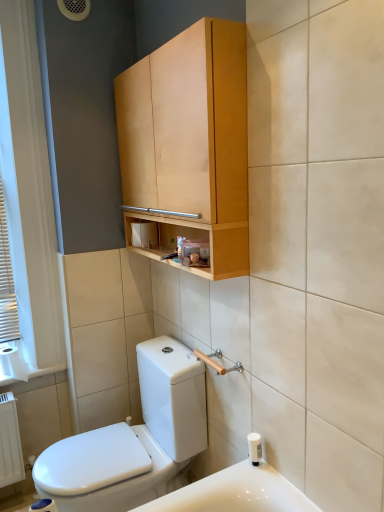
Where is `white glossy toilet at lower left`? white glossy toilet at lower left is located at coordinates (133, 439).

The height and width of the screenshot is (512, 384). In order to click on white matte toilet paper at center in this screenshot , I will do `click(144, 234)`.

Where is `white paper at left`? white paper at left is located at coordinates pos(12,362).

What do you see at coordinates (12, 362) in the screenshot? Image resolution: width=384 pixels, height=512 pixels. I see `white paper at left` at bounding box center [12, 362].

This screenshot has height=512, width=384. In order to click on light wood cabinet at upper center in this screenshot , I will do `click(189, 143)`.

Where is `white wooden blinds at left`? The height and width of the screenshot is (512, 384). white wooden blinds at left is located at coordinates (6, 282).

From a real-world perspective, does white plastic soap dispenser at lower right sit lower than white glossy toilet at lower left?

No, from a real-world perspective, white plastic soap dispenser at lower right is not beneath white glossy toilet at lower left.

Where is `toiletry above the white glossy toilet at lower left (from the image's perspective)`? toiletry above the white glossy toilet at lower left (from the image's perspective) is located at coordinates (254, 448).

Is white plastic soap dispenser at lower right positioned before white glossy toilet at lower left?

No, white plastic soap dispenser at lower right is further to the viewer.

This screenshot has width=384, height=512. I want to click on toiletry on the right of white paper at left, so click(x=254, y=448).

In the scene shown: Considering the sizes of white plastic soap dispenser at lower right and white paper at left in the image, is white plastic soap dispenser at lower right bigger or smaller than white paper at left?

Clearly, white plastic soap dispenser at lower right is smaller in size than white paper at left.

Is point (256, 441) closer or farther from the camera than point (13, 356)?

Point (256, 441) is closer to the camera than point (13, 356).

From the image's perspective, which is below, white wooden blinds at left or white glossy toilet at lower left?

From the image's view, white glossy toilet at lower left is below.

In terms of width, does white wooden blinds at left look wider or thinner when compared to white glossy toilet at lower left?

Clearly, white wooden blinds at left has less width compared to white glossy toilet at lower left.

Considering the positions of objects white wooden blinds at left and white glossy toilet at lower left in the image provided, who is more to the left, white wooden blinds at left or white glossy toilet at lower left?

Positioned to the left is white wooden blinds at left.

Which of these two, white wooden blinds at left or white glossy toilet at lower left, is smaller?

With smaller size is white wooden blinds at left.

Does point (132, 168) come behind point (17, 374)?

No.

From a real-world perspective, is light wood cabinet at upper center over white paper at left?

Yes, from a real-world perspective, light wood cabinet at upper center is on top of white paper at left.

Is light wood cabinet at upper center taller than white paper at left?

Correct, light wood cabinet at upper center is much taller as white paper at left.

Could you tell me if light wood cabinet at upper center is facing white paper at left?

No.

Looking at this image, could you tell me if white matte toilet paper at center is facing white paper at left?

No, white matte toilet paper at center is not oriented towards white paper at left.

Considering the sizes of objects white matte toilet paper at center and white paper at left in the image provided, who is bigger, white matte toilet paper at center or white paper at left?

white paper at left.

Would you say white matte toilet paper at center is outside white paper at left?

Yes, white matte toilet paper at center is outside of white paper at left.

From a real-world perspective, relative to white paper at left, is white matte toilet paper at center vertically above or below?

In terms of real-world spatial position, white matte toilet paper at center is above white paper at left.

Does point (172, 179) lie in front of point (145, 243)?

Yes, it is.

The height and width of the screenshot is (512, 384). In order to click on toilet paper behind the light wood cabinet at upper center in this screenshot , I will do `click(144, 234)`.

Consider the image. Is light wood cabinet at upper center looking in the opposite direction of white matte toilet paper at center?

Yes, light wood cabinet at upper center's orientation is away from white matte toilet paper at center.

In terms of width, does white matte toilet paper at center look wider or thinner when compared to light wood cabinet at upper center?

In the image, white matte toilet paper at center appears to be more narrow than light wood cabinet at upper center.

Is white matte toilet paper at center placed right next to light wood cabinet at upper center?

No, white matte toilet paper at center is not making contact with light wood cabinet at upper center.

Considering the positions of objects white matte toilet paper at center and light wood cabinet at upper center in the image provided, who is more to the left, white matte toilet paper at center or light wood cabinet at upper center?

white matte toilet paper at center.

Between white matte toilet paper at center and light wood cabinet at upper center, which one has larger size?

With larger size is light wood cabinet at upper center.

This screenshot has width=384, height=512. Identify the location of toilet in front of the white plastic soap dispenser at lower right. (133, 439).

Locate an element on the screen. toiletry located underneath the white paper at left (from a real-world perspective) is located at coordinates (254, 448).

Estimate the real-world distances between objects in this image. Which object is closer to white wooden blinds at left, white plastic soap dispenser at lower right or light wood cabinet at upper center?

Based on the image, light wood cabinet at upper center appears to be nearer to white wooden blinds at left.

Based on their spatial positions, is white wooden blinds at left or white glossy toilet at lower left closer to light wood cabinet at upper center?

The object closer to light wood cabinet at upper center is white glossy toilet at lower left.

From the image, which object appears to be nearer to light wood cabinet at upper center, white wooden blinds at left or white matte toilet paper at center?

Based on the image, white matte toilet paper at center appears to be nearer to light wood cabinet at upper center.

Looking at the image, which one is located further to white paper at left, white glossy toilet at lower left or white matte toilet paper at center?

The object further to white paper at left is white matte toilet paper at center.

Estimate the real-world distances between objects in this image. Which object is closer to white matte toilet paper at center, white paper at left or white wooden blinds at left?

white wooden blinds at left is closer to white matte toilet paper at center.

From the image, which object appears to be nearer to white wooden blinds at left, light wood cabinet at upper center or white plastic soap dispenser at lower right?

The object closer to white wooden blinds at left is light wood cabinet at upper center.

Based on their spatial positions, is white glossy toilet at lower left or light wood cabinet at upper center further from white wooden blinds at left?

light wood cabinet at upper center.

Considering their positions, is white paper at left positioned further to white wooden blinds at left than white glossy toilet at lower left?

Based on the image, white glossy toilet at lower left appears to be further to white wooden blinds at left.

This screenshot has width=384, height=512. Find the location of `to paper situated between white wooden blinds at left and white plastic soap dispenser at lower right from left to right`. to paper situated between white wooden blinds at left and white plastic soap dispenser at lower right from left to right is located at coordinates (12, 362).

Locate an element on the screen. to paper between white wooden blinds at left and white matte toilet paper at center in the horizontal direction is located at coordinates (12, 362).

Image resolution: width=384 pixels, height=512 pixels. Identify the location of toiletry between light wood cabinet at upper center and white glossy toilet at lower left vertically. click(254, 448).

This screenshot has height=512, width=384. I want to click on bathroom cabinet between white paper at left and white plastic soap dispenser at lower right, so click(189, 143).